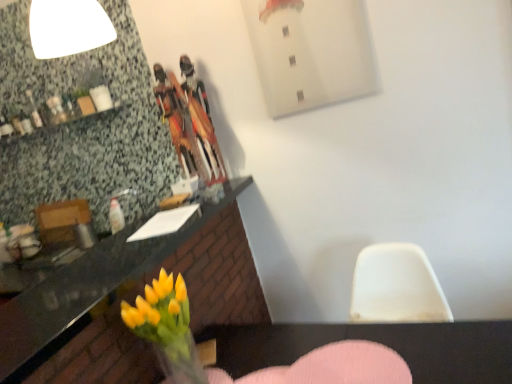
Measure the distance between granite countertop at lower left and camera.

1.11 meters.

Identify the location of yellow glass vase at lower left. The image size is (512, 384). (167, 327).

Looking at this image, what is the approximate width of yellow glass vase at lower left?

12.35 inches.

Identify the location of pink fabric armchair at lower center. Image resolution: width=512 pixels, height=384 pixels. (331, 367).

Is pink fabric armchair at lower center closer to camera compared to yellow glass vase at lower left?

Yes.

Between pink fabric armchair at lower center and yellow glass vase at lower left, which one appears on the left side from the viewer's perspective?

From the viewer's perspective, yellow glass vase at lower left appears more on the left side.

Would you consider pink fabric armchair at lower center to be distant from yellow glass vase at lower left?

No.

Based on the photo, is yellow glass vase at lower left positioned far away from granite countertop at lower left?

That's not correct — yellow glass vase at lower left is a little close to granite countertop at lower left.

Which is in front, point (146, 335) or point (179, 266)?

Point (146, 335)

Find the location of a particular element. Image resolution: width=512 pixels, height=384 pixels. countertop that appears in front of the yellow glass vase at lower left is located at coordinates (129, 301).

In the scene shown: Considering the sizes of objects yellow glass vase at lower left and granite countertop at lower left in the image provided, who is shorter, yellow glass vase at lower left or granite countertop at lower left?

Standing shorter between the two is granite countertop at lower left.

Between granite countertop at lower left and yellow glass vase at lower left, which one has more height?

yellow glass vase at lower left.

Can you tell me how much granite countertop at lower left and yellow glass vase at lower left differ in facing direction?

The facing directions of granite countertop at lower left and yellow glass vase at lower left are 91 degrees apart.

Where is `floral arrangement that is under the granite countertop at lower left (from a real-world perspective)`? The image size is (512, 384). floral arrangement that is under the granite countertop at lower left (from a real-world perspective) is located at coordinates [x=167, y=327].

How far apart are granite countertop at lower left and yellow glass vase at lower left?

granite countertop at lower left is 12.03 inches away from yellow glass vase at lower left.

From a real-world perspective, is granite countertop at lower left over pink fabric armchair at lower center?

Yes, from a real-world perspective, granite countertop at lower left is on top of pink fabric armchair at lower center.

From the image's perspective, is granite countertop at lower left beneath pink fabric armchair at lower center?

No, from the image's perspective, granite countertop at lower left is not beneath pink fabric armchair at lower center.

Do you think granite countertop at lower left is within pink fabric armchair at lower center, or outside of it?

granite countertop at lower left lies outside pink fabric armchair at lower center.

Does granite countertop at lower left appear on the right side of pink fabric armchair at lower center?

Incorrect, granite countertop at lower left is not on the right side of pink fabric armchair at lower center.

Is pink fabric armchair at lower center facing towards granite countertop at lower left?

No.

Which of these two, pink fabric armchair at lower center or granite countertop at lower left, is wider?

granite countertop at lower left.

This screenshot has width=512, height=384. I want to click on countertop that appears above the pink fabric armchair at lower center (from the image's perspective), so click(x=129, y=301).

From the image's perspective, is pink fabric armchair at lower center over granite countertop at lower left?

No.

Which object is closer to the camera taking this photo, yellow glass vase at lower left or pink fabric armchair at lower center?

pink fabric armchair at lower center.

The height and width of the screenshot is (384, 512). What are the coordinates of `floral arrangement above the pink fabric armchair at lower center (from a real-world perspective)` in the screenshot? It's located at (167, 327).

Is yellow glass vase at lower left facing towards pink fabric armchair at lower center?

No, yellow glass vase at lower left does not turn towards pink fabric armchair at lower center.

Where is `floral arrangement on the left of pink fabric armchair at lower center`? The height and width of the screenshot is (384, 512). floral arrangement on the left of pink fabric armchair at lower center is located at coordinates (167, 327).

Identify the location of countertop above the yellow glass vase at lower left (from a real-world perspective). This screenshot has width=512, height=384. (x=129, y=301).

Looking at the image, which one is located further to granite countertop at lower left, pink fabric armchair at lower center or yellow glass vase at lower left?

pink fabric armchair at lower center.

From the picture: From the image, which object appears to be nearer to pink fabric armchair at lower center, granite countertop at lower left or yellow glass vase at lower left?

yellow glass vase at lower left is closer to pink fabric armchair at lower center.

Which object lies nearer to the anchor point yellow glass vase at lower left, pink fabric armchair at lower center or granite countertop at lower left?

granite countertop at lower left is closer to yellow glass vase at lower left.

Considering their positions, is yellow glass vase at lower left positioned closer to pink fabric armchair at lower center than granite countertop at lower left?

yellow glass vase at lower left is positioned closer to the anchor pink fabric armchair at lower center.

Which object lies further to the anchor point yellow glass vase at lower left, granite countertop at lower left or pink fabric armchair at lower center?

pink fabric armchair at lower center lies further to yellow glass vase at lower left than the other object.

Which object lies further to the anchor point granite countertop at lower left, yellow glass vase at lower left or pink fabric armchair at lower center?

Based on the image, pink fabric armchair at lower center appears to be further to granite countertop at lower left.

This screenshot has height=384, width=512. Find the location of `floral arrangement between granite countertop at lower left and pink fabric armchair at lower center from left to right`. floral arrangement between granite countertop at lower left and pink fabric armchair at lower center from left to right is located at coordinates (167, 327).